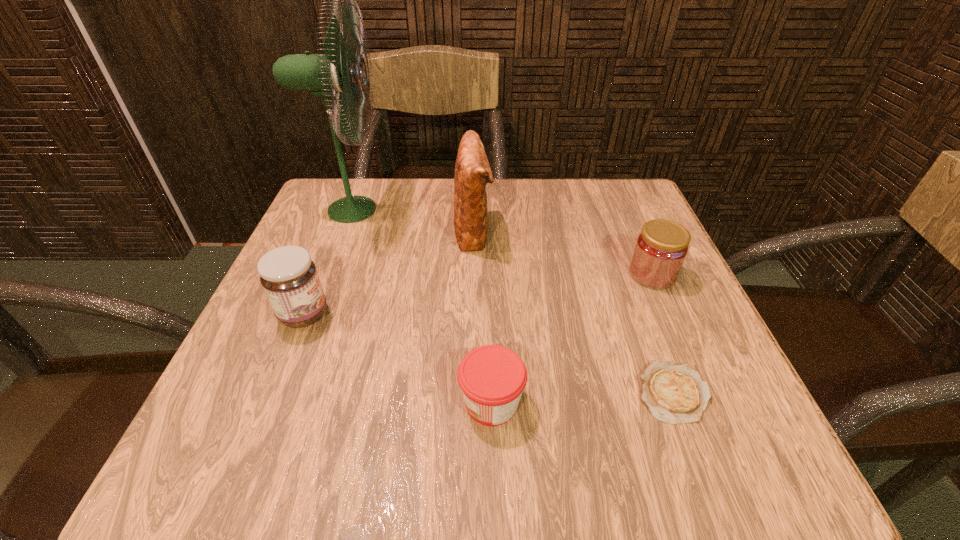
Identify the location of free space between the third nearest object and the fourth nearest object. (478, 294).

In order to click on free space that is in between the shortest object and the tallest object in this screenshot , I will do `click(512, 301)`.

The width and height of the screenshot is (960, 540). In order to click on free spot between the shortest object and the shortest jam in this screenshot , I will do `click(582, 397)`.

The width and height of the screenshot is (960, 540). What are the coordinates of `the third closest object relative to the tallest object` in the screenshot? It's located at (492, 378).

The height and width of the screenshot is (540, 960). In order to click on object that ranks as the third closest to the shortest object in this screenshot , I will do `click(472, 171)`.

Point out which jam is positioned as the nearest to the fan. Please provide its 2D coordinates. Your answer should be formatted as a tuple, i.e. [(x, y)], where the tuple contains the x and y coordinates of a point satisfying the conditions above.

[(289, 277)]

The width and height of the screenshot is (960, 540). Identify the location of jam that is the third closest one to the second tallest object. (492, 378).

At what (x,y) coordinates should I click in order to perform the action: click on vacant space that satisfies the following two spatial constraints: 1. on the back side of the shortest object; 2. on the open side of the fifth shortest object. Please return your answer as a coordinate pair (x, y). Image resolution: width=960 pixels, height=540 pixels. Looking at the image, I should click on (612, 231).

Where is `free space in the image that satisfies the following two spatial constraints: 1. on the front label of the quiche; 2. on the right side of the second farthest jam`? The height and width of the screenshot is (540, 960). free space in the image that satisfies the following two spatial constraints: 1. on the front label of the quiche; 2. on the right side of the second farthest jam is located at coordinates (272, 392).

This screenshot has width=960, height=540. Find the location of `vacant space that satisfies the following two spatial constraints: 1. on the front-facing side of the shortest object; 2. on the right side of the tallest object`. vacant space that satisfies the following two spatial constraints: 1. on the front-facing side of the shortest object; 2. on the right side of the tallest object is located at coordinates (279, 392).